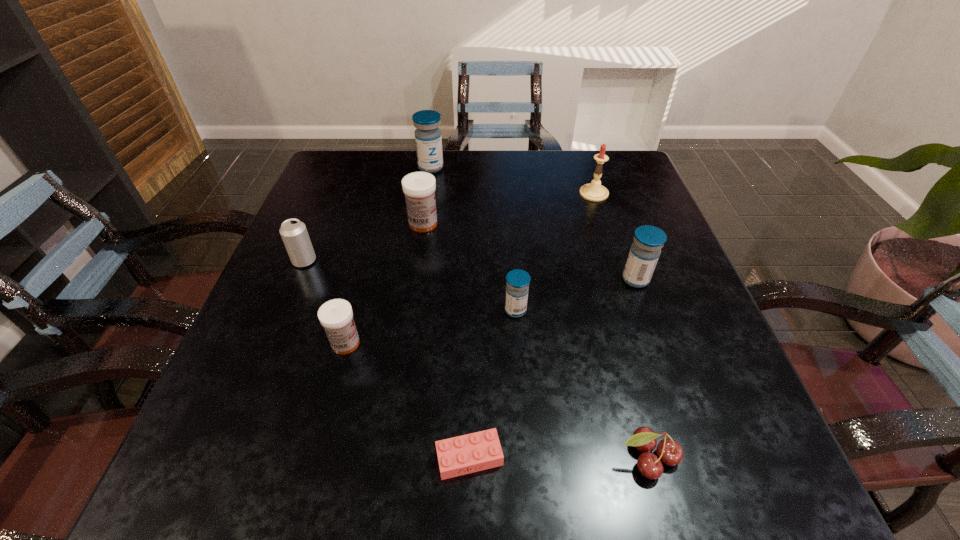
Image resolution: width=960 pixels, height=540 pixels. I want to click on free space located on the front of the right white medicine, so click(x=418, y=263).

Locate an element on the screen. The image size is (960, 540). free space located on the left of the second smallest blue medicine is located at coordinates (444, 279).

The image size is (960, 540). In order to click on vacant space located on the front of the white beer can in this screenshot , I will do `click(290, 296)`.

The width and height of the screenshot is (960, 540). I want to click on vacant region located 0.370m on the back of the smallest blue medicine, so click(507, 195).

Where is `vacant area located 0.330m on the right of the leftmost medicine`? The height and width of the screenshot is (540, 960). vacant area located 0.330m on the right of the leftmost medicine is located at coordinates (541, 343).

I want to click on free region located on the right of the shortest object, so click(x=590, y=457).

The image size is (960, 540). I want to click on medicine that is at the far edge, so click(x=428, y=139).

At what (x,y) coordinates should I click in order to perform the action: click on candle positioned at the far edge. Please return your answer as a coordinate pair (x, y). Looking at the image, I should click on (594, 191).

Where is `cherry located in the near edge section of the desktop`? cherry located in the near edge section of the desktop is located at coordinates (669, 451).

Find the location of a particular element. Image resolution: width=960 pixels, height=540 pixels. Lego located at the near edge is located at coordinates (478, 451).